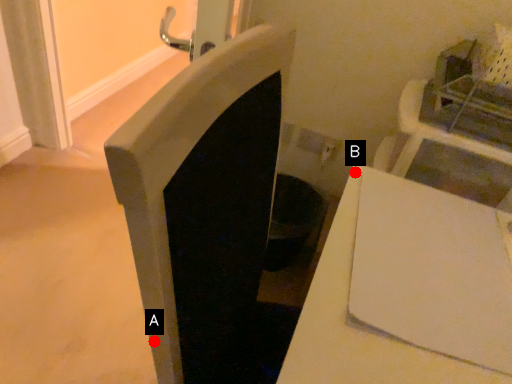
Question: Two points are circled on the image, labeled by A and B beside each circle. Which point appears closest to the camera in this image?

Choices:
 (A) A is closer
 (B) B is closer

Answer: (A)